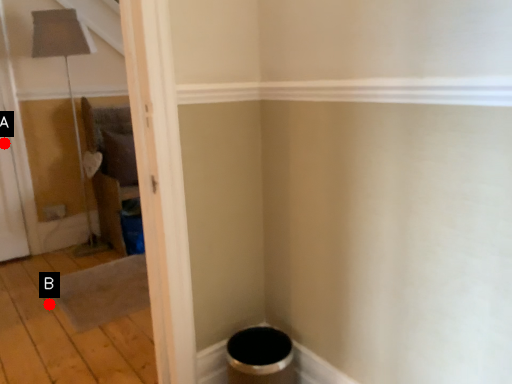
Question: Two points are circled on the image, labeled by A and B beside each circle. Among these points, which one is farthest from the camera?

Choices:
 (A) A is further
 (B) B is further

Answer: (A)